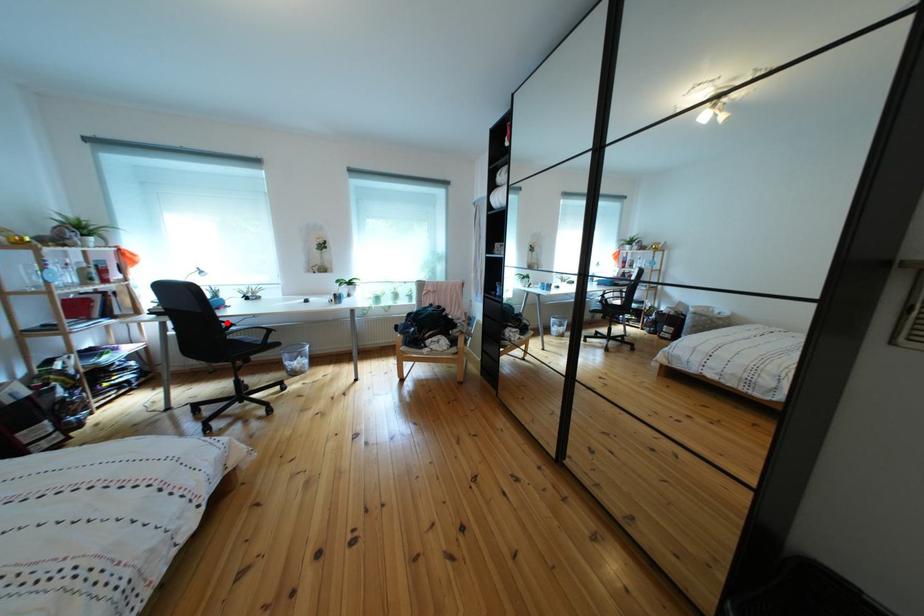
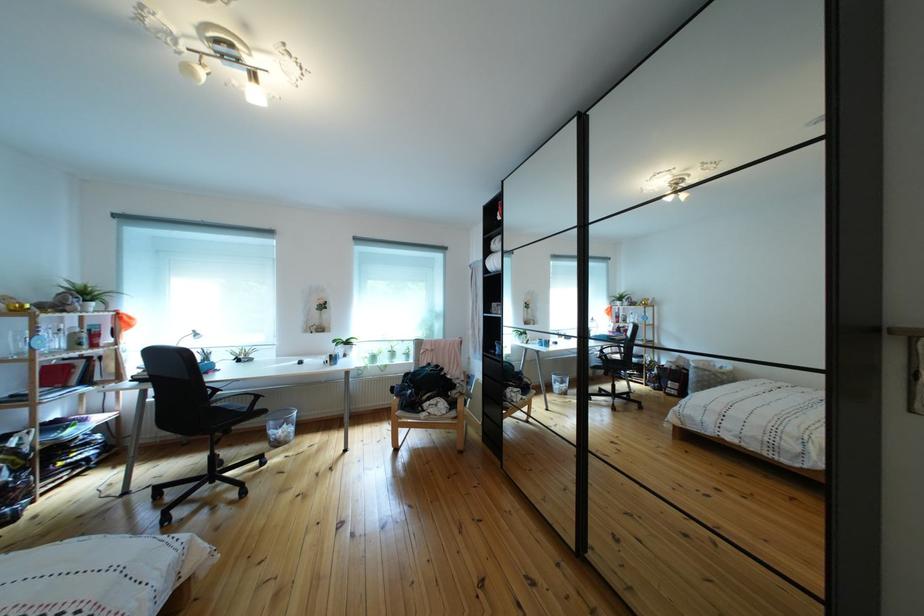
Locate, in the second image, the point that corresponds to the highlighted location in the first image.

(214, 389)